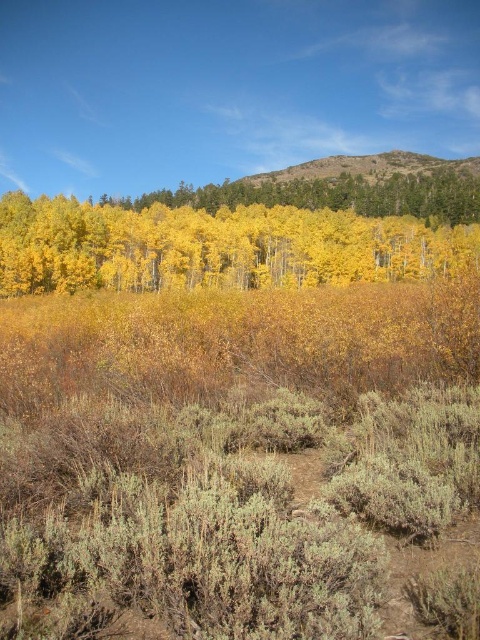
You are standing in the autumn forest scene and want to determine which of the two points, point (x=70, y=221) or point (x=387, y=188), is closer to you. Based on the image, which point is nearer?

Point (x=70, y=221) is closer to the viewer than point (x=387, y=188).

Based on the photo, you are standing at the point marked as point (215, 246) in the image. Looking around, you see yellow matte trees at center. Which direction should you walk to reach the nearest area with low vegetation like sagebrush and dry grasses?

Since point (215, 246) is located on the yellow matte trees at center, you should walk towards the foreground to reach the nearest area with low vegetation like sagebrush and dry grasses, as the foreground is described as having a mix of low vegetation such as sagebrush and dry grasses.